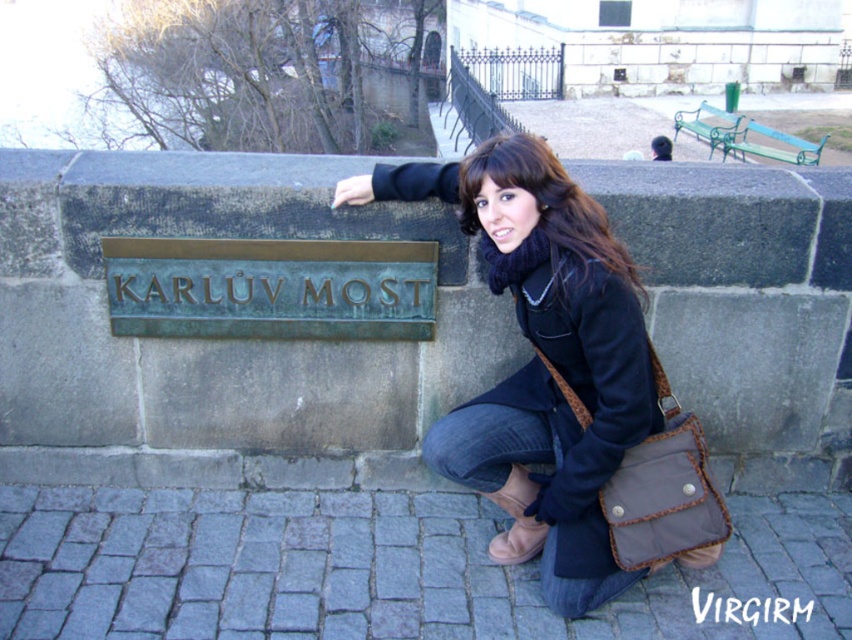
Can you confirm if matte black coat at center is positioned above bronze/kinetic sandblastedsign at center?

Incorrect, matte black coat at center is not positioned above bronze/kinetic sandblastedsign at center.

Which is above, matte black coat at center or bronze/kinetic sandblastedsign at center?

bronze/kinetic sandblastedsign at center

Does point (536, 269) lie behind point (389, 330)?

No, it is in front of (389, 330).

Where is `matte black coat at center`? The image size is (852, 640). matte black coat at center is located at coordinates (565, 385).

Who is taller, matte black coat at center or matte black scarf at center?

matte black coat at center

I want to click on matte black coat at center, so click(565, 385).

Which is behind, point (459, 211) or point (510, 141)?

Positioned behind is point (459, 211).

The height and width of the screenshot is (640, 852). I want to click on matte black coat at center, so click(x=565, y=385).

Between bronze/kinetic sandblastedsign at center and matte black scarf at center, which one is positioned lower?

bronze/kinetic sandblastedsign at center is lower down.

Can you confirm if bronze/kinetic sandblastedsign at center is bigger than matte black scarf at center?

No.

The height and width of the screenshot is (640, 852). What do you see at coordinates (269, 288) in the screenshot?
I see `bronze/kinetic sandblastedsign at center` at bounding box center [269, 288].

The image size is (852, 640). I want to click on bronze/kinetic sandblastedsign at center, so click(x=269, y=288).